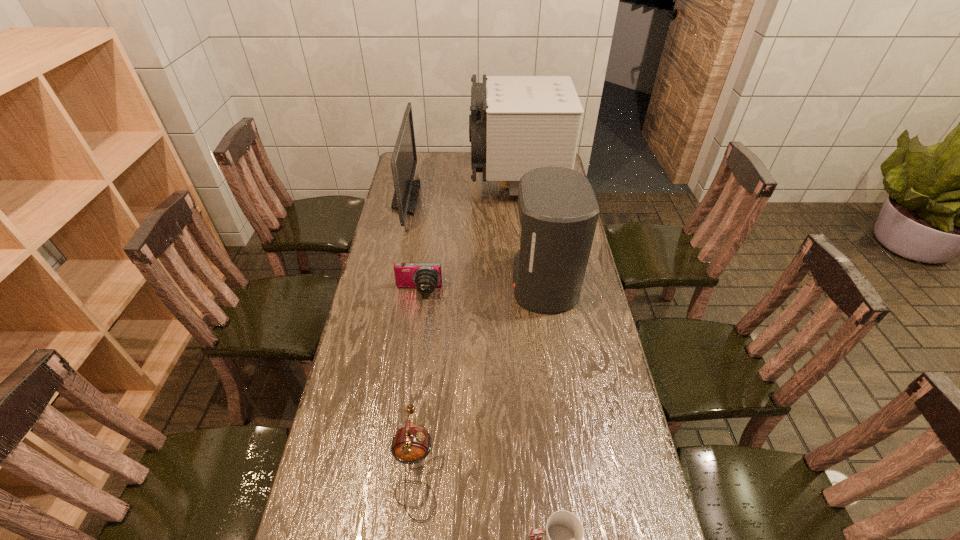
At what (x,y) coordinates should I click in order to perform the action: click on free space located on the front-facing side of the camera. Please return your answer as a coordinate pair (x, y). The width and height of the screenshot is (960, 540). Looking at the image, I should click on (414, 326).

Locate an element on the screen. The image size is (960, 540). free point located on the rotary dial of the telephone is located at coordinates (555, 468).

What are the coordinates of `fan that is at the far edge` in the screenshot? It's located at (517, 123).

Where is `monitor located at the far edge`? The image size is (960, 540). monitor located at the far edge is located at coordinates (404, 159).

Identify the location of monitor that is at the left edge. (404, 159).

Where is `camera present at the left edge`? This screenshot has height=540, width=960. camera present at the left edge is located at coordinates (425, 277).

This screenshot has height=540, width=960. Find the location of `fan that is at the right edge`. fan that is at the right edge is located at coordinates (517, 123).

This screenshot has height=540, width=960. In order to click on coffee maker located in the right edge section of the desktop in this screenshot , I will do `click(558, 211)`.

Locate an element on the screen. This screenshot has width=960, height=540. object that is at the far left corner is located at coordinates (404, 159).

Locate an element on the screen. This screenshot has width=960, height=540. object that is positioned at the far right corner is located at coordinates (517, 123).